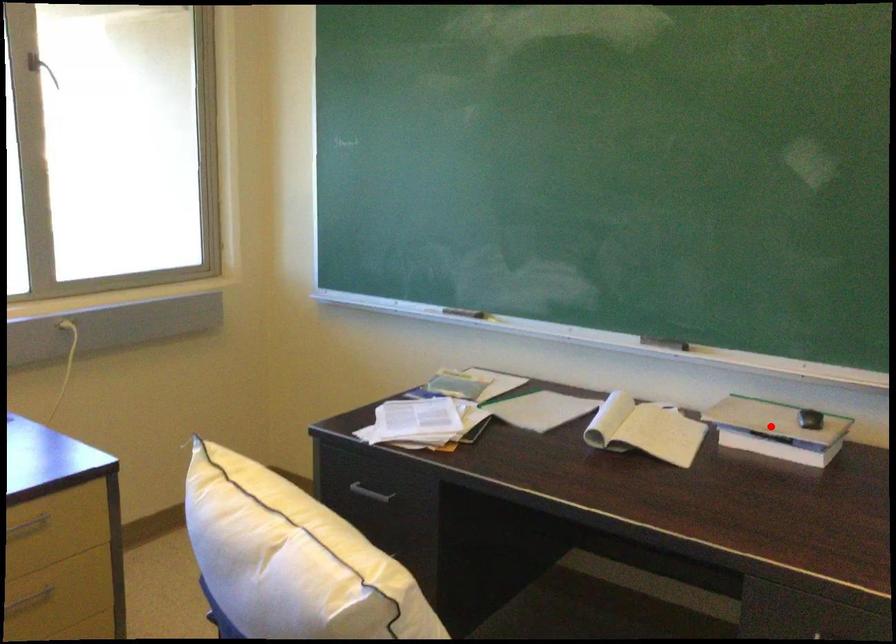
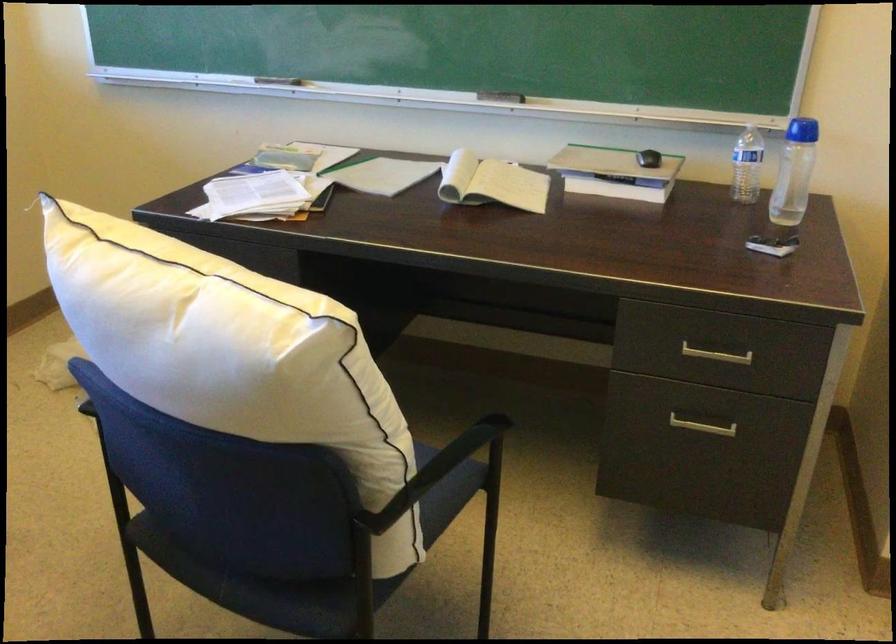
Question: I am providing you with two images of the same scene from different viewpoints. A red point is marked on the first image. Is the red point's position out of view in image 2?

Choices:
 (A) Yes
 (B) No

Answer: (B)